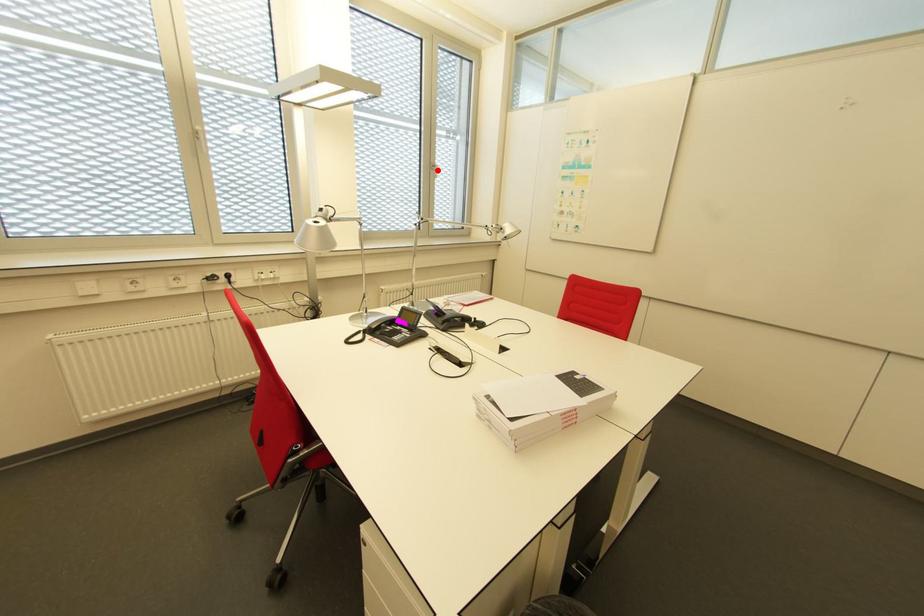
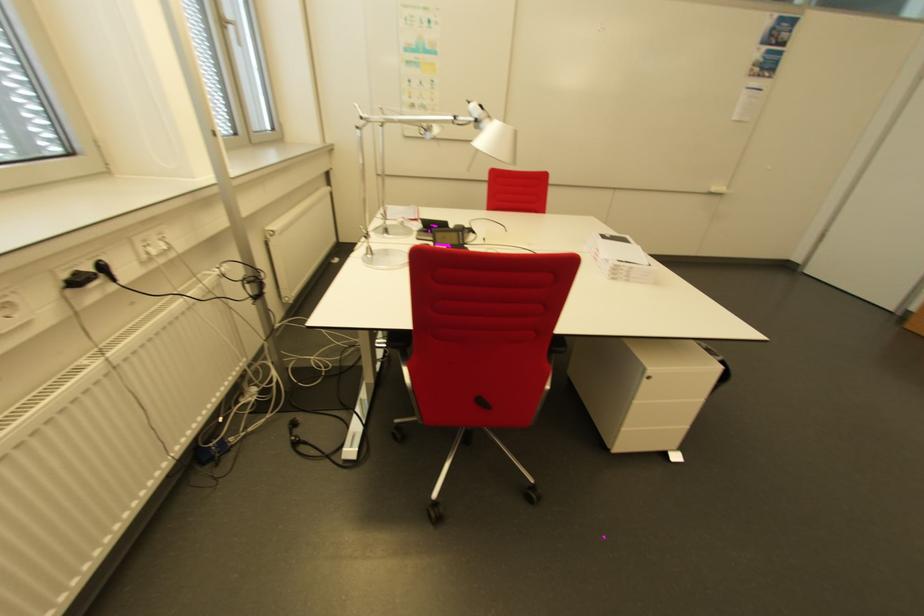
Locate, in the second image, the point that corresponds to the highlighted location in the first image.

(235, 31)